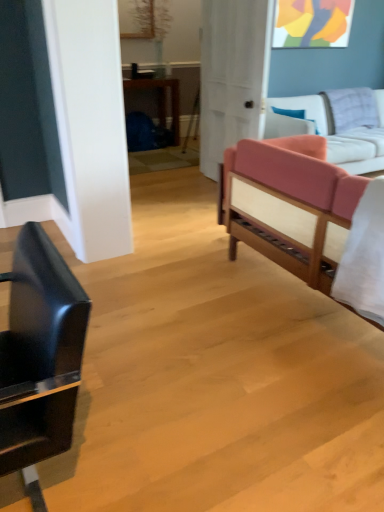
Where is `vacant space to the left of pink fabric couch at right, the second studio couch from the back`? This screenshot has height=512, width=384. vacant space to the left of pink fabric couch at right, the second studio couch from the back is located at coordinates (186, 288).